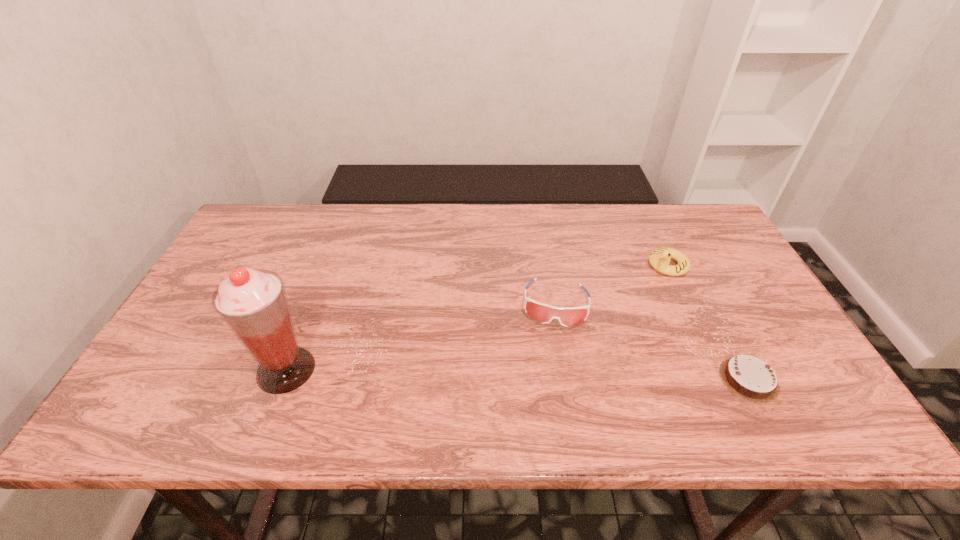
I want to click on free spot located on the front-facing side of the goggles, so click(551, 366).

In order to click on blank space located 0.110m on the face of the farthest object in this screenshot , I will do `click(631, 289)`.

Identify the location of free space located 0.290m on the face of the farthest object. (586, 319).

This screenshot has width=960, height=540. I want to click on free space located on the face of the farthest object, so click(612, 302).

Identify the location of smoothie present at the near edge. The width and height of the screenshot is (960, 540). (253, 303).

This screenshot has width=960, height=540. I want to click on chocolate cake positioned at the near edge, so click(748, 377).

This screenshot has width=960, height=540. Identify the location of chocolate cake that is at the right edge. (748, 377).

Find the location of a particular element. The width and height of the screenshot is (960, 540). duckling located in the right edge section of the desktop is located at coordinates (659, 258).

Locate an element on the screen. object that is at the near right corner is located at coordinates (748, 377).

The height and width of the screenshot is (540, 960). Find the location of `vacant region at the far edge of the desktop`. vacant region at the far edge of the desktop is located at coordinates (503, 221).